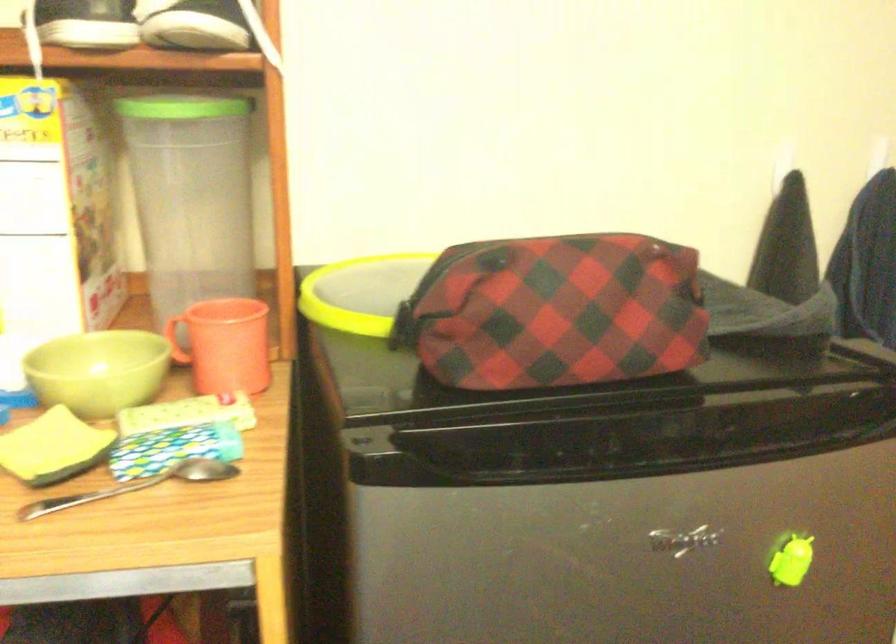
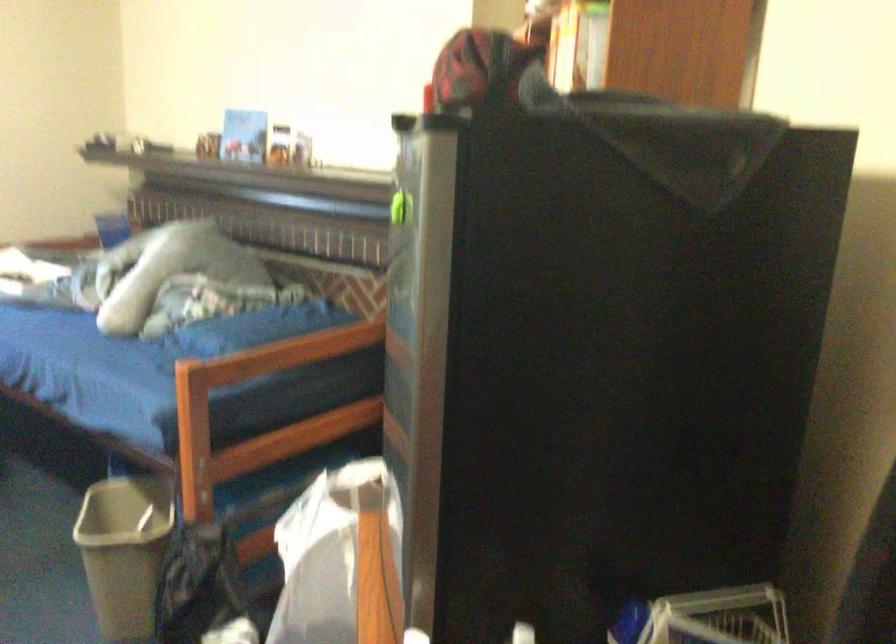
Question: I am providing you with two images of the same scene from different viewpoints. Please identify which objects are invisible in image2.

Choices:
 (A) green magnetic clip
 (B) blind pull handle
 (C) green bowl
 (D) white wire basket

Answer: (C)